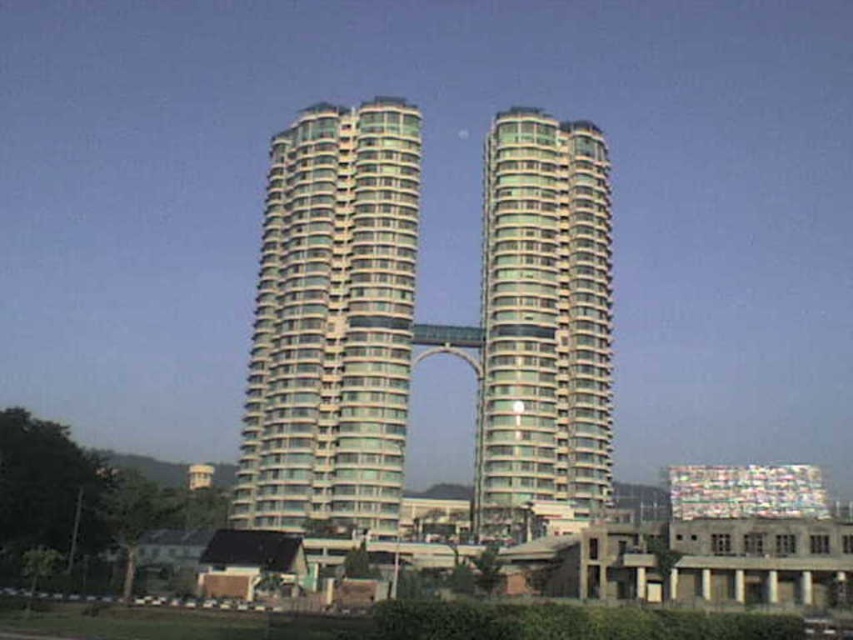
Does glassy teal skyscraper at center have a lesser width compared to glassy green tower at center?

No.

Does glassy teal skyscraper at center have a lesser height compared to glassy green tower at center?

No.

I want to click on glassy teal skyscraper at center, so click(x=332, y=323).

Locate an element on the screen. This screenshot has height=640, width=853. glassy teal skyscraper at center is located at coordinates (332, 323).